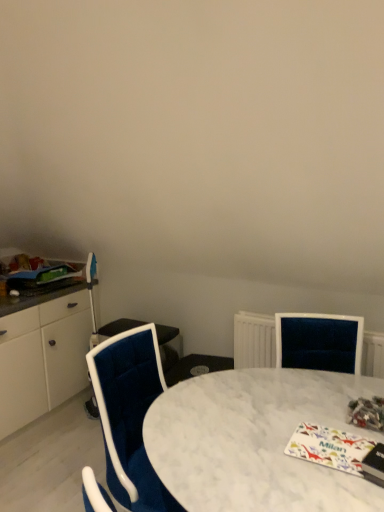
Locate an element on the screen. vacant area that is in front of white glossy magazine at lower right, the 2th magazine when ordered from left to right is located at coordinates (326, 486).